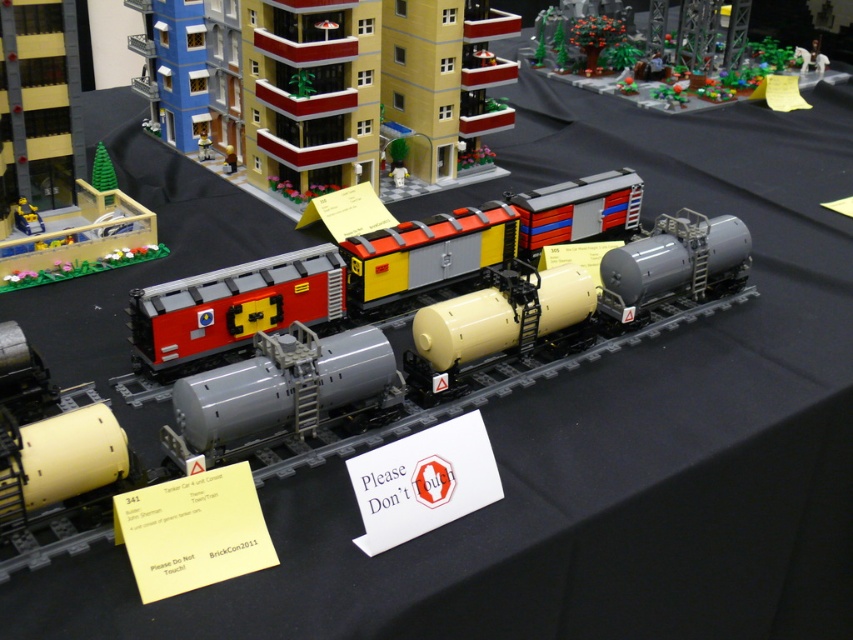
Question: Can you confirm if brick man at center is positioned above matte gray train car at center?

Choices:
 (A) no
 (B) yes

Answer: (B)

Question: Among these points, which one is farthest from the camera?

Choices:
 (A) (131, 250)
 (B) (196, 141)
 (C) (392, 240)

Answer: (B)

Question: Which of the following is the farthest from the observer?

Choices:
 (A) (245, 292)
 (B) (198, 150)
 (C) (801, 45)
 (D) (120, 237)

Answer: (C)

Question: From the image, what is the correct spatial relationship of matte black train car at center in relation to brick man at center?

Choices:
 (A) left
 (B) right

Answer: (B)

Question: Which object is positioned farthest from the matte black train car at left?

Choices:
 (A) brick man at center
 (B) matte black train car at center

Answer: (A)

Question: Does matte black train car at left have a greater width compared to brick man at center?

Choices:
 (A) no
 (B) yes

Answer: (B)